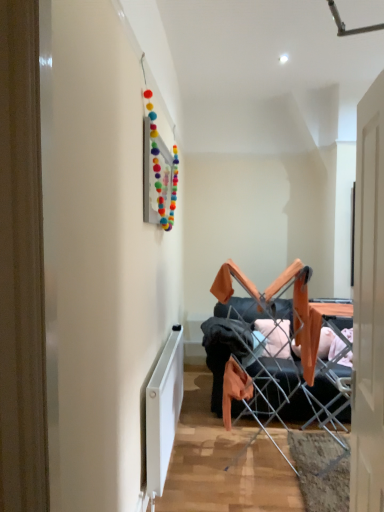
Image resolution: width=384 pixels, height=512 pixels. What are the coordinates of `white matte radiator at lower left` in the screenshot? It's located at (163, 410).

This screenshot has width=384, height=512. What do you see at coordinates (163, 410) in the screenshot? I see `white matte radiator at lower left` at bounding box center [163, 410].

This screenshot has width=384, height=512. What do you see at coordinates (281, 356) in the screenshot?
I see `orange fabric chair at center` at bounding box center [281, 356].

At what (x,y) coordinates should I click in order to perform the action: click on orange fabric chair at center. Please return your answer as a coordinate pair (x, y). Looking at the image, I should click on (281, 356).

What is the approximate height of orange fabric chair at center?

orange fabric chair at center is 4.38 feet in height.

Find the location of `white matte radiator at lower left`. white matte radiator at lower left is located at coordinates (163, 410).

Consider the image. Can you confirm if white matte radiator at lower left is positioned to the right of orange fabric chair at center?

No.

Which object is closer to the camera taking this photo, white matte radiator at lower left or orange fabric chair at center?

white matte radiator at lower left is in front.

Between point (168, 379) and point (260, 372), which one is positioned in front?

Positioned in front is point (168, 379).

From the image's perspective, which object appears higher, white matte radiator at lower left or orange fabric chair at center?

orange fabric chair at center appears higher in the image.

From a real-world perspective, is white matte radiator at lower left positioned over orange fabric chair at center based on gravity?

No.

Looking at their sizes, would you say white matte radiator at lower left is wider or thinner than orange fabric chair at center?

white matte radiator at lower left is thinner than orange fabric chair at center.

From their relative heights in the image, would you say white matte radiator at lower left is taller or shorter than orange fabric chair at center?

white matte radiator at lower left is shorter than orange fabric chair at center.

Considering the relative sizes of white matte radiator at lower left and orange fabric chair at center in the image provided, is white matte radiator at lower left smaller than orange fabric chair at center?

Correct, white matte radiator at lower left occupies less space than orange fabric chair at center.

Is white matte radiator at lower left surrounding orange fabric chair at center?

No, orange fabric chair at center is not inside white matte radiator at lower left.

Are white matte radiator at lower left and orange fabric chair at center located far from each other?

Actually, white matte radiator at lower left and orange fabric chair at center are a little close together.

Is orange fabric chair at center at the back of white matte radiator at lower left?

No, white matte radiator at lower left is not facing the opposite direction of orange fabric chair at center.

You are a GUI agent. You are given a task and a screenshot of the screen. Output one action in this format:
    pyautogui.click(x=<x>, y=<y>)
    Task: Click on the chair that appears behind the white matte radiator at lower left
    The width and height of the screenshot is (384, 512).
    Given the screenshot: What is the action you would take?
    pyautogui.click(x=281, y=356)

Based on their positions, is orange fabric chair at center located to the left or right of white matte radiator at lower left?

orange fabric chair at center is to the right of white matte radiator at lower left.

Which object is further away from the camera taking this photo, orange fabric chair at center or white matte radiator at lower left?

orange fabric chair at center.

Between point (296, 334) and point (163, 387), which one is positioned behind?

Point (296, 334)

From the image's perspective, does orange fabric chair at center appear lower than white matte radiator at lower left?

No.

From a real-world perspective, which is physically below, orange fabric chair at center or white matte radiator at lower left?

From a 3D spatial view, white matte radiator at lower left is below.

Does orange fabric chair at center have a lesser width compared to white matte radiator at lower left?

In fact, orange fabric chair at center might be wider than white matte radiator at lower left.

Considering the relative sizes of orange fabric chair at center and white matte radiator at lower left in the image provided, is orange fabric chair at center taller than white matte radiator at lower left?

Indeed, orange fabric chair at center has a greater height compared to white matte radiator at lower left.

Between orange fabric chair at center and white matte radiator at lower left, which one has larger size?

Bigger between the two is orange fabric chair at center.

Would you say orange fabric chair at center is inside or outside white matte radiator at lower left?

orange fabric chair at center exists outside the volume of white matte radiator at lower left.

Is orange fabric chair at center next to white matte radiator at lower left?

No, orange fabric chair at center is not with white matte radiator at lower left.

Could you tell me if orange fabric chair at center is turned towards white matte radiator at lower left?

No, orange fabric chair at center is not facing towards white matte radiator at lower left.

Can you tell me how much orange fabric chair at center and white matte radiator at lower left differ in facing direction?

orange fabric chair at center and white matte radiator at lower left are facing 92.3 degrees away from each other.

Measure the distance from orange fabric chair at center to white matte radiator at lower left.

orange fabric chair at center is 31.40 inches from white matte radiator at lower left.

Identify the location of chair that is behind the white matte radiator at lower left. The image size is (384, 512). (281, 356).

Identify the location of radiator lying in front of the orange fabric chair at center. (163, 410).

Find the location of a particular element. The width and height of the screenshot is (384, 512). radiator below the orange fabric chair at center (from the image's perspective) is located at coordinates (163, 410).